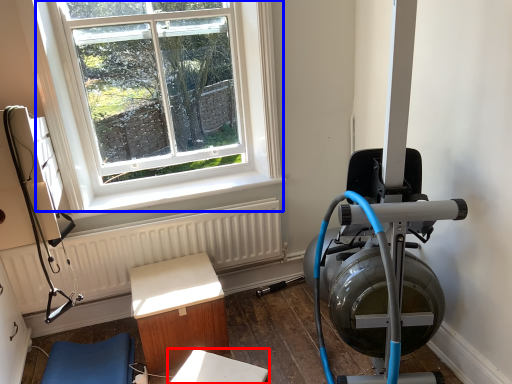
Question: Which of the following is the closest to the observer, table (highlighted by a red box) or window (highlighted by a blue box)?

Choices:
 (A) table
 (B) window

Answer: (A)